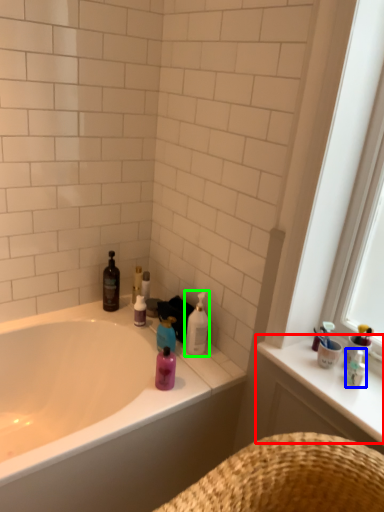
Question: Considering the real-world distances, which object is farthest from counter top (highlighted by a red box)? toiletry (highlighted by a blue box) or cleaning product (highlighted by a green box)?

Choices:
 (A) toiletry
 (B) cleaning product

Answer: (B)